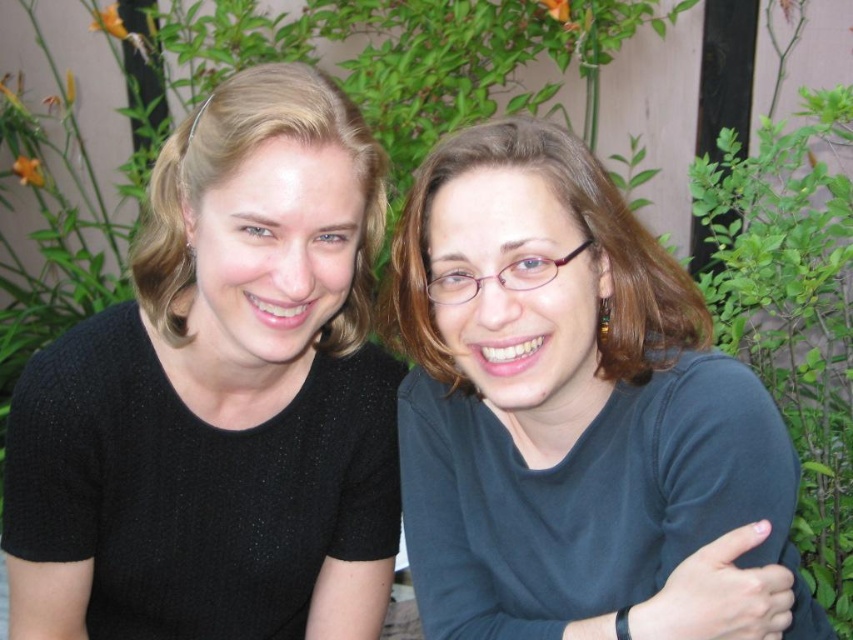
Question: Can you confirm if black knit sweater at left is positioned above dark blue fabric shirt at center?

Choices:
 (A) no
 (B) yes

Answer: (B)

Question: Observing the image, what is the correct spatial positioning of black knit sweater at left in reference to dark blue fabric shirt at center?

Choices:
 (A) above
 (B) below

Answer: (A)

Question: Can you confirm if black knit sweater at left is thinner than dark blue fabric shirt at center?

Choices:
 (A) yes
 (B) no

Answer: (A)

Question: Which point is closer to the camera?

Choices:
 (A) dark blue fabric shirt at center
 (B) black knit sweater at left

Answer: (A)